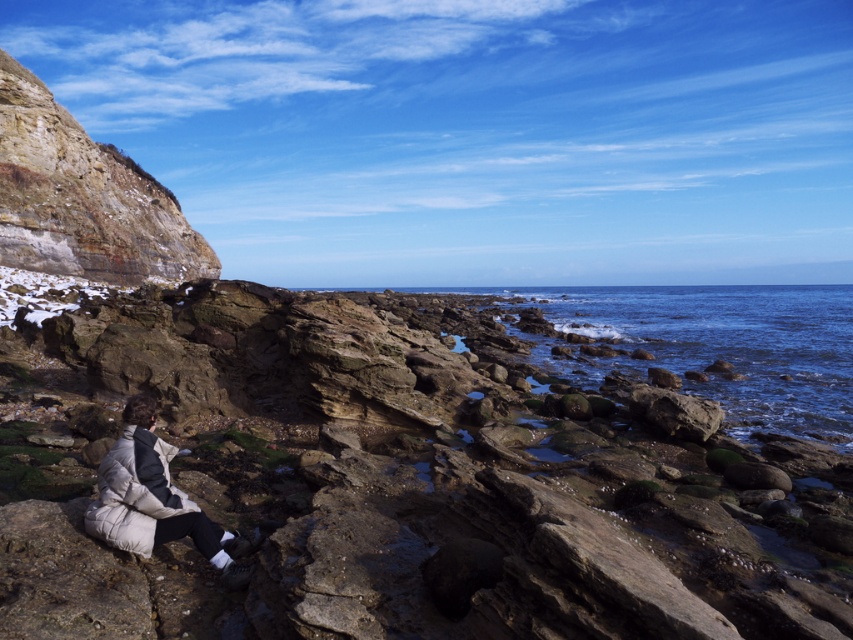
Question: Can you confirm if rustic stone cliff at upper left is bigger than white puffy jacket at lower left?

Choices:
 (A) no
 (B) yes

Answer: (B)

Question: Among these points, which one is farthest from the camera?

Choices:
 (A) (120, 525)
 (B) (100, 154)

Answer: (B)

Question: Which object appears closest to the camera in this image?

Choices:
 (A) white puffy jacket at lower left
 (B) rustic stone cliff at upper left

Answer: (A)

Question: Does rustic stone cliff at upper left appear over white puffy jacket at lower left?

Choices:
 (A) no
 (B) yes

Answer: (B)

Question: Which of the following is the closest to the observer?

Choices:
 (A) coord(201,538)
 (B) coord(99,234)

Answer: (A)

Question: Is rustic stone cliff at upper left to the right of white puffy jacket at lower left from the viewer's perspective?

Choices:
 (A) yes
 (B) no

Answer: (B)